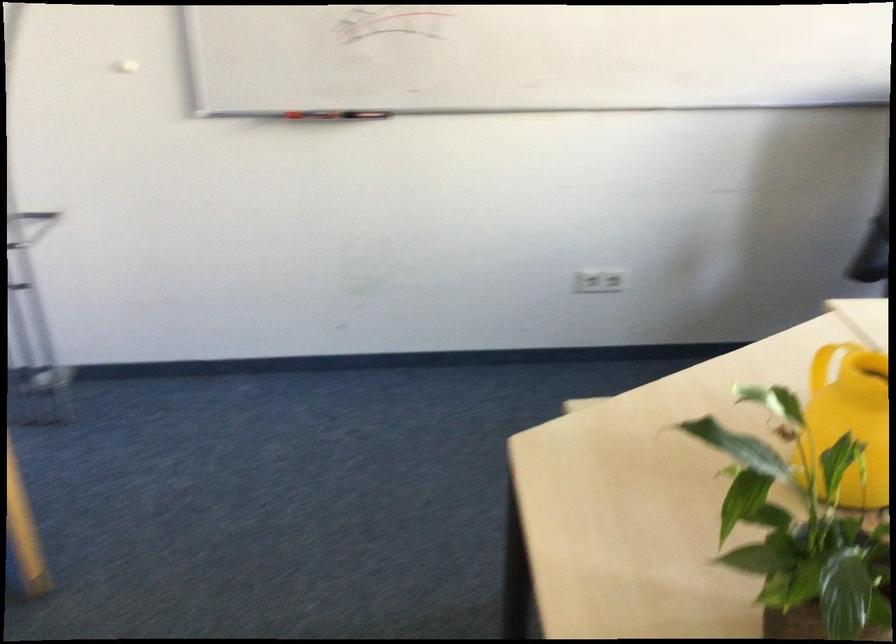
I want to click on red whiteboard marker, so click(330, 114).